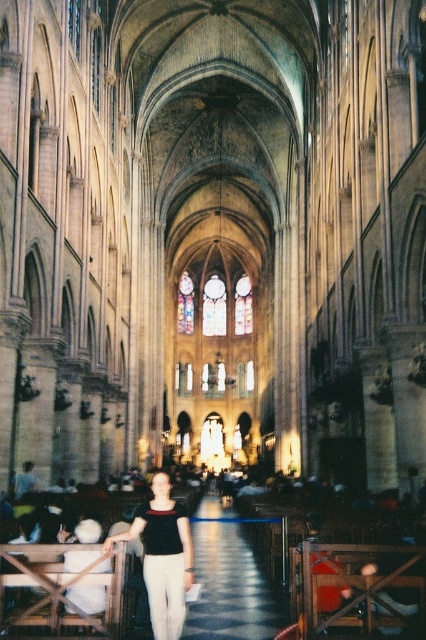
Question: Can you confirm if polished stone aisle at center is positioned to the left of matte black blouse at center?

Choices:
 (A) no
 (B) yes

Answer: (A)

Question: Which of the following is the closest to the observer?

Choices:
 (A) polished stone aisle at center
 (B) matte black blouse at center

Answer: (B)

Question: From the image, what is the correct spatial relationship of polished stone aisle at center in relation to matte black blouse at center?

Choices:
 (A) left
 (B) right

Answer: (B)

Question: Does polished stone aisle at center have a larger size compared to matte black blouse at center?

Choices:
 (A) yes
 (B) no

Answer: (A)

Question: Which point is farther from the camera taking this photo?

Choices:
 (A) (227, 586)
 (B) (155, 611)

Answer: (A)